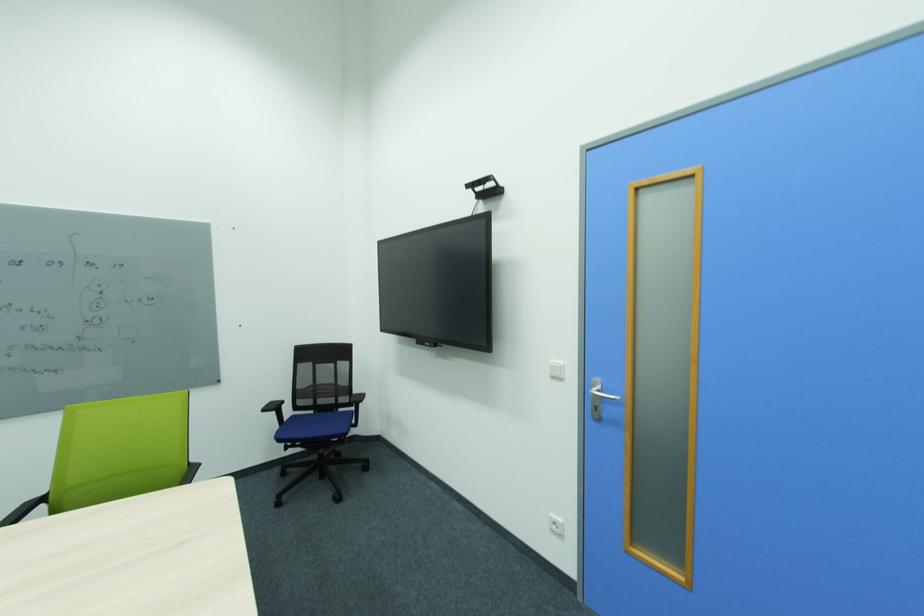
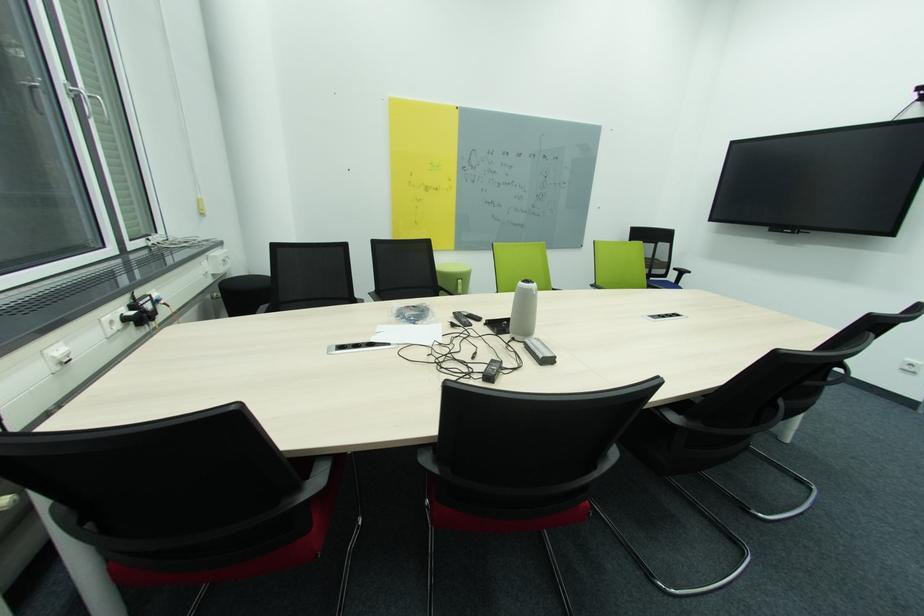
What movement of the cameraman would produce the second image?

The cameraman moved toward left, backward.